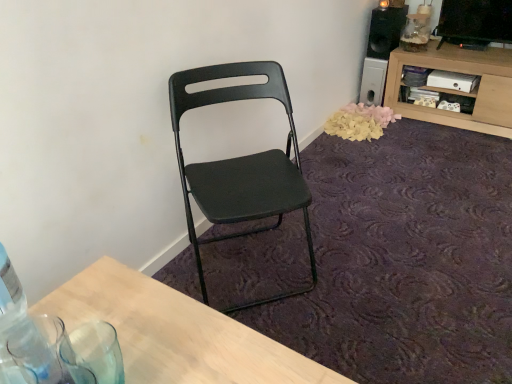
The height and width of the screenshot is (384, 512). In order to click on spots to the right of yellow paper petals at lower right in this screenshot , I will do `click(428, 130)`.